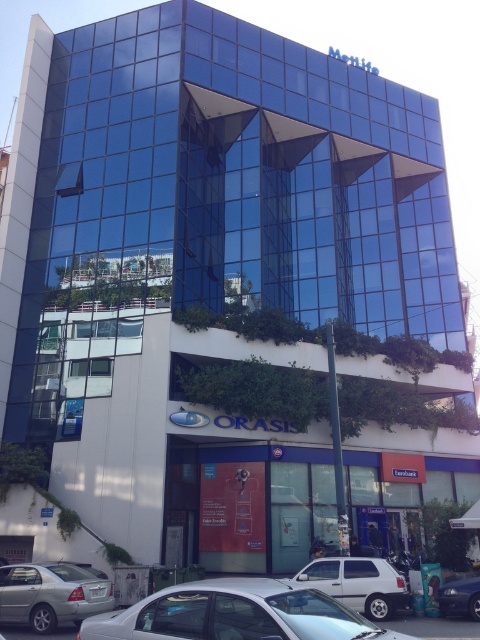
You are a delivery person approaching the entrance of the building with a package. You see the white matte car at lower center and the shiny blue sedan at lower right. Which car is closer to the entrance?

The white matte car at lower center is closer to the entrance because it is positioned to the left of the shiny blue sedan at lower right, which is further away from the entrance.

You are a delivery person with a cart that is 6 feet wide. You need to navigate through the space between the white matte car at lower center and the shiny blue sedan at lower right to reach the entrance of the building. Can your cart fit through that space?

The distance between the white matte car at lower center and the shiny blue sedan at lower right is 5.89 feet. Since your cart is 6 feet wide, it is slightly wider than the available space, so the cart cannot fit through the space between them.

You are standing at the entrance of the ORASIS commercial space and see a point marked at coordinates (236, 614). What object does this point correspond to?

The point at coordinates (236, 614) corresponds to the silver metallic car at lower center.